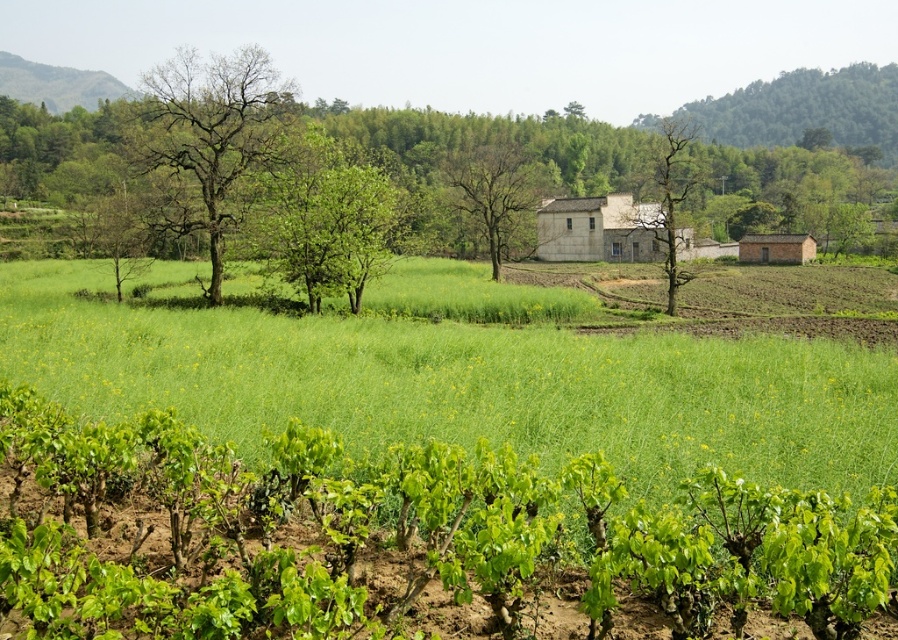
Can you confirm if green leafy tree at center is positioned to the right of bare wood tree at center?

In fact, green leafy tree at center is to the left of bare wood tree at center.

Is point (277, 266) positioned in front of point (459, 189)?

Yes.

Describe the element at coordinates (330, 228) in the screenshot. I see `green leafy tree at center` at that location.

I want to click on green leafy tree at center, so click(330, 228).

Who is higher up, green leafy vines at lower center or bare wood tree at center?

Positioned higher is bare wood tree at center.

Which is more to the left, green leafy vines at lower center or bare wood tree at center?

Positioned to the left is green leafy vines at lower center.

Is point (104, 548) closer to viewer compared to point (511, 154)?

Yes, point (104, 548) is in front of point (511, 154).

The width and height of the screenshot is (898, 640). I want to click on green leafy vines at lower center, so click(395, 536).

Looking at this image, is bare branches at left positioned behind green grassy hillside at upper left?

That is False.

Can you confirm if bare branches at left is positioned to the left of green grassy hillside at upper left?

No, bare branches at left is not to the left of green grassy hillside at upper left.

Who is more distant from viewer, (186, 156) or (7, 67)?

Answer: Point (7, 67)

At what (x,y) coordinates should I click in order to perform the action: click on bare branches at left. Please return your answer as a coordinate pair (x, y). Looking at the image, I should click on (207, 138).